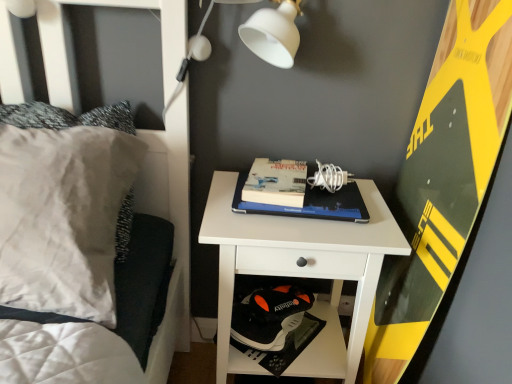
The image size is (512, 384). What are the coordinates of `free location in front of hardcover book at center, the second paperback book when ordered from right to left` in the screenshot? It's located at (279, 230).